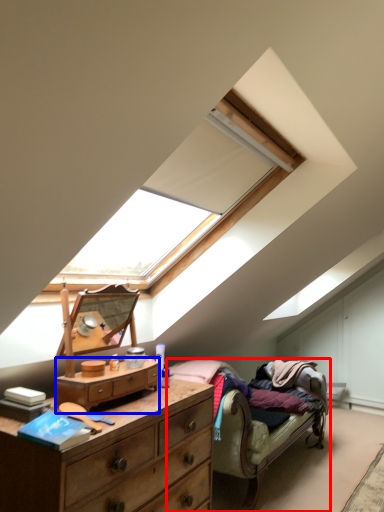
Question: Which of the following is the closest to the observer, studio couch (highlighted by a red box) or chest of drawers (highlighted by a blue box)?

Choices:
 (A) studio couch
 (B) chest of drawers

Answer: (B)